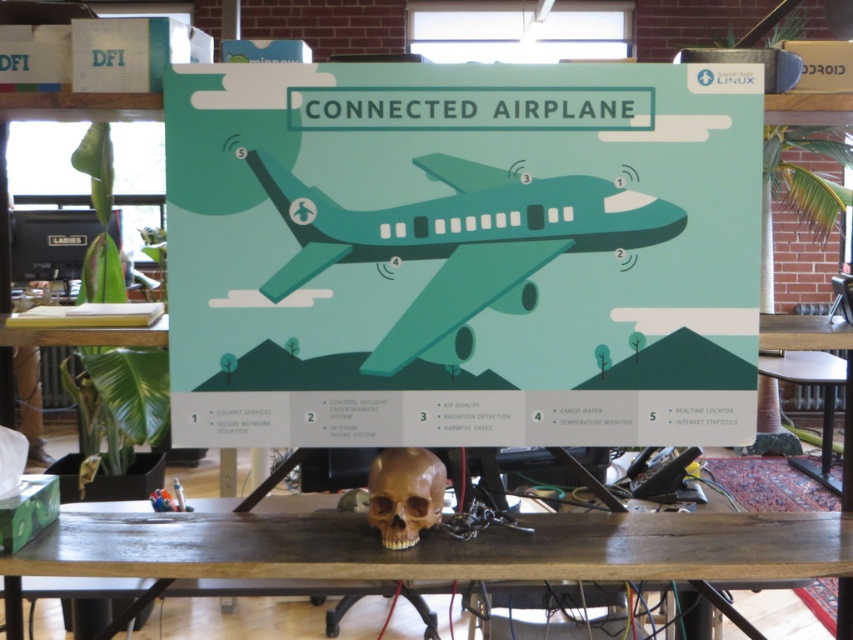
You are an airport security officer inspecting the poster. You notice both the teal glossy airplane at center and the brown matte skull at center. Which object is larger in size?

The teal glossy airplane at center is bigger than the brown matte skull at center according to the description.

You are standing in an office and see the teal paper airplane at center and the brown wood table at center. Which object is closer to you?

The teal paper airplane at center is closer to you than the brown wood table at center.

You are standing 2 meters away from the poster. Can you see the point at position (202,554) clearly?

The distance of point (202,554) from viewer is 1.96 meters, so yes, you can see the point clearly as you are standing at 2 meters which is just slightly farther than the point itself.